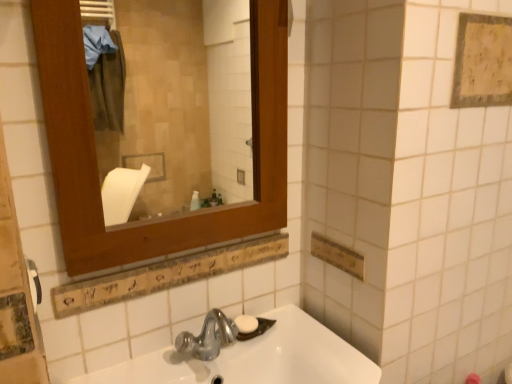
Question: Considering their positions, is white matte soap at center located in front of or behind yellowish textured fabric at upper right?

Choices:
 (A) behind
 (B) front

Answer: (A)

Question: Considering the relative positions of white matte soap at center and yellowish textured fabric at upper right in the image provided, is white matte soap at center to the left or to the right of yellowish textured fabric at upper right?

Choices:
 (A) right
 (B) left

Answer: (B)

Question: Considering the real-world distances, which object is closest to the white glossy sink at lower center?

Choices:
 (A) white plastic towel bar at left
 (B) wooden frame at upper left
 (C) yellowish textured fabric at upper right
 (D) white matte soap at center

Answer: (D)

Question: Which object is the farthest from the white glossy sink at lower center?

Choices:
 (A) wooden frame at upper left
 (B) white matte soap at center
 (C) yellowish textured fabric at upper right
 (D) white plastic towel bar at left

Answer: (A)